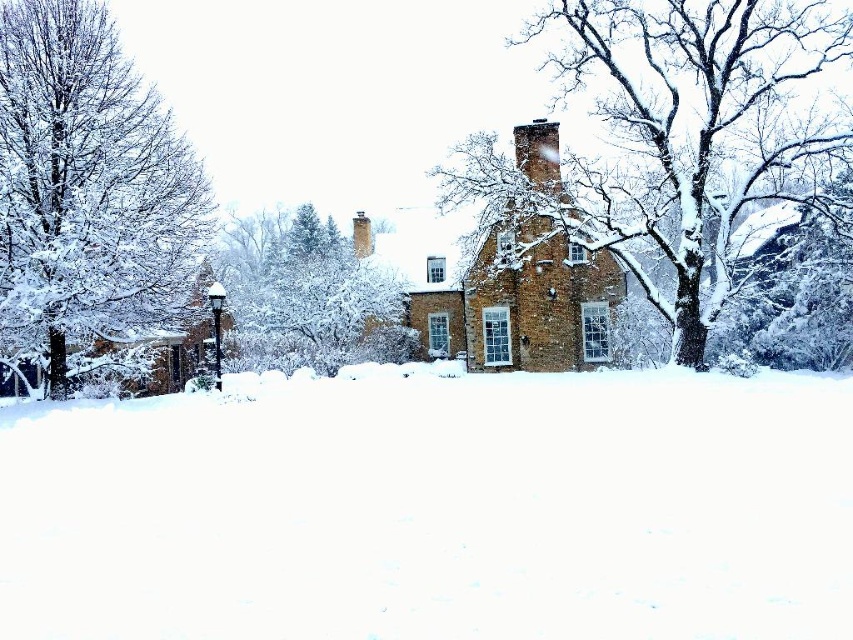
Between snow-covered bark tree at upper right and snow-covered evergreen at center, which one is positioned higher?

snow-covered bark tree at upper right

Can you confirm if snow-covered bark tree at upper right is positioned to the left of snow-covered evergreen at center?

No, snow-covered bark tree at upper right is not to the left of snow-covered evergreen at center.

The width and height of the screenshot is (853, 640). Describe the element at coordinates (669, 134) in the screenshot. I see `snow-covered bark tree at upper right` at that location.

Where is `snow-covered bark tree at upper right`? The image size is (853, 640). snow-covered bark tree at upper right is located at coordinates (669, 134).

Which is below, snow-covered bark tree at upper right or snow-covered tree at left?

Positioned lower is snow-covered tree at left.

Between point (672, 97) and point (137, 90), which one is positioned in front?

Positioned in front is point (672, 97).

Between point (531, 182) and point (172, 241), which one is positioned in front?

Point (531, 182)

Identify the location of snow-covered bark tree at upper right. The width and height of the screenshot is (853, 640). (669, 134).

Is point (416, 522) positioned after point (138, 273)?

That is False.

Can you confirm if white fluffy snow at center is positioned above snow-covered tree at left?

Actually, white fluffy snow at center is below snow-covered tree at left.

Between point (822, 595) and point (73, 204), which one is positioned in front?

Positioned in front is point (822, 595).

At what (x,y) coordinates should I click in order to perform the action: click on white fluffy snow at center. Please return your answer as a coordinate pair (x, y). Looking at the image, I should click on coord(433,508).